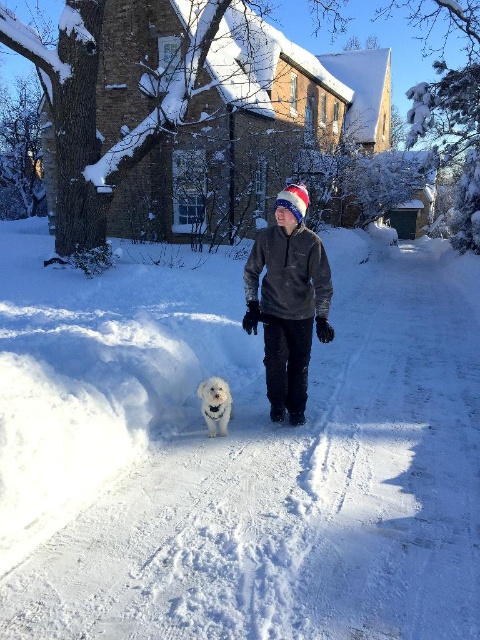
Consider the image. How distant is dark gray fleece at center from white fluffy dog at center?

dark gray fleece at center is 69.96 centimeters away from white fluffy dog at center.

Does dark gray fleece at center have a lesser height compared to white fluffy dog at center?

No, dark gray fleece at center is not shorter than white fluffy dog at center.

The height and width of the screenshot is (640, 480). Identify the location of dark gray fleece at center. (288, 301).

You are a GUI agent. You are given a task and a screenshot of the screen. Output one action in this format:
    pyautogui.click(x=<x>, y=<y>)
    Task: Click on the dark gray fleece at center
    The height and width of the screenshot is (640, 480).
    Given the screenshot: What is the action you would take?
    pyautogui.click(x=288, y=301)